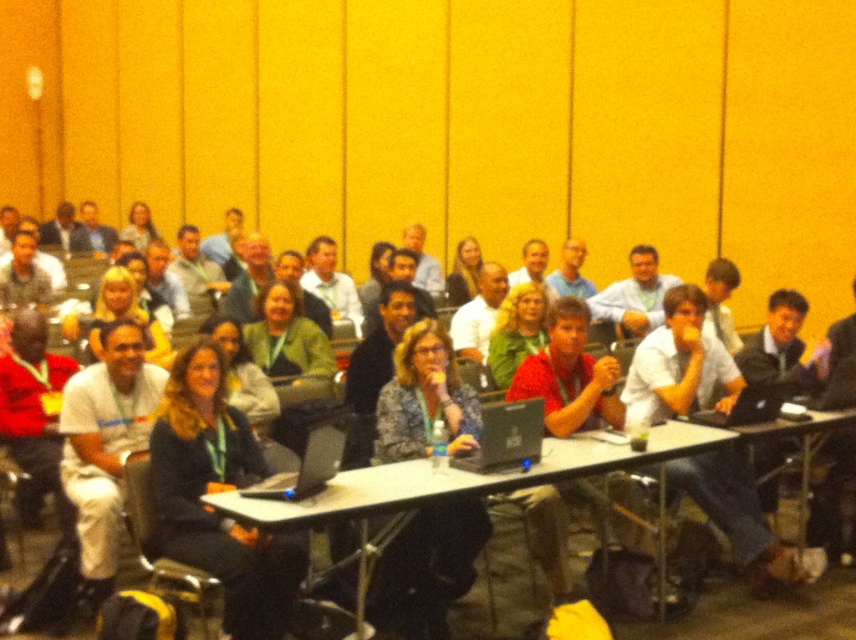
Question: Which object is the closest to the white plastic table at center?

Choices:
 (A) white shirt at center
 (B) dark blue sweater at center

Answer: (A)

Question: Which of these objects is positioned farthest from the white plastic table at center?

Choices:
 (A) black matte laptop at center
 (B) black plastic laptop at center
 (C) black glossy laptop at center

Answer: (C)

Question: Is the position of dark blue sweater at center more distant than that of black plastic laptop at center?

Choices:
 (A) yes
 (B) no

Answer: (B)

Question: Which object is farther from the camera taking this photo?

Choices:
 (A) black plastic laptop at center
 (B) blue denim jacket at center

Answer: (B)

Question: Is white shirt at center to the left of black plastic laptop at center from the viewer's perspective?

Choices:
 (A) yes
 (B) no

Answer: (B)

Question: Does dark blue sweater at center have a smaller size compared to black matte laptop at center?

Choices:
 (A) yes
 (B) no

Answer: (B)